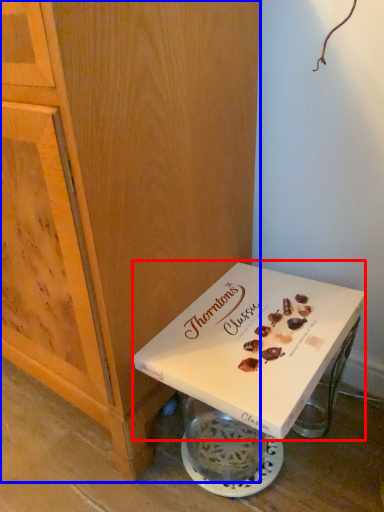
Question: Which object is further to the camera taking this photo, box (highlighted by a red box) or cabinetry (highlighted by a blue box)?

Choices:
 (A) box
 (B) cabinetry

Answer: (A)